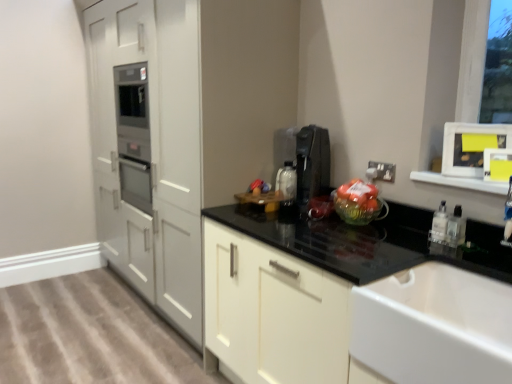
What do you see at coordinates (356, 199) in the screenshot? The width and height of the screenshot is (512, 384). I see `translucent plastic bag of oranges at center-right` at bounding box center [356, 199].

This screenshot has height=384, width=512. Describe the element at coordinates (439, 224) in the screenshot. I see `clear plastic bottle at right, which is the 2th bottle from right to left` at that location.

How much space does clear plastic bottle at right, the first bottle when ordered from left to right, occupy horizontally?

clear plastic bottle at right, the first bottle when ordered from left to right, is 2.99 inches in width.

What do you see at coordinates (384, 171) in the screenshot?
I see `white plastic electric outlet at upper right` at bounding box center [384, 171].

In order to click on translucent plastic bag of oranges at center-right in this screenshot , I will do `click(356, 199)`.

From a real-world perspective, who is located higher, clear plastic bottle at right, which is the 2th bottle from right to left, or translucent plastic bag of oranges at center-right?

translucent plastic bag of oranges at center-right is physically above.

Can you confirm if clear plastic bottle at right, the first bottle when ordered from left to right, is thinner than translucent plastic bag of oranges at center-right?

Yes, clear plastic bottle at right, the first bottle when ordered from left to right, is thinner than translucent plastic bag of oranges at center-right.

Is clear plastic bottle at right, the first bottle when ordered from left to right, not near translucent plastic bag of oranges at center-right?

Actually, clear plastic bottle at right, the first bottle when ordered from left to right, and translucent plastic bag of oranges at center-right are a little close together.

Does clear plastic bottle at right, the first bottle when ordered from left to right, appear on the left side of translucent plastic bag of oranges at center-right?

No.

Where is `glass bowl below the white plastic electric outlet at upper right (from the image's perspective)`? This screenshot has width=512, height=384. glass bowl below the white plastic electric outlet at upper right (from the image's perspective) is located at coordinates (359, 211).

From a real-world perspective, relative to white plastic electric outlet at upper right, is translucent glass bowl at center vertically above or below?

From a real-world perspective, translucent glass bowl at center is physically below white plastic electric outlet at upper right.

Who is more distant, translucent glass bowl at center or white plastic electric outlet at upper right?

white plastic electric outlet at upper right is further from the camera.

Image resolution: width=512 pixels, height=384 pixels. What are the coordinates of `appliance above the translucent glass bowl at center (from the image's perspective)` in the screenshot? It's located at (312, 163).

Is black plastic coffee machine at upper right situated inside translucent glass bowl at center or outside?

black plastic coffee machine at upper right is outside translucent glass bowl at center.

From a real-world perspective, is black plastic coffee machine at upper right physically above translucent glass bowl at center?

Correct, in the physical world, black plastic coffee machine at upper right is higher than translucent glass bowl at center.

How many degrees apart are the facing directions of black plastic coffee machine at upper right and translucent glass bowl at center?

There is a 1.95-degree angle between the facing directions of black plastic coffee machine at upper right and translucent glass bowl at center.

Is white glossy sink at lower right not near black plastic coffee machine at upper right?

No, there isn't a large distance between white glossy sink at lower right and black plastic coffee machine at upper right.

Does white glossy sink at lower right have a lesser height compared to black plastic coffee machine at upper right?

Yes, white glossy sink at lower right is shorter than black plastic coffee machine at upper right.

From the image's perspective, does white glossy sink at lower right appear lower than black plastic coffee machine at upper right?

Yes.

Could you tell me if white glossy sink at lower right is turned towards black plastic coffee machine at upper right?

No, white glossy sink at lower right is not aimed at black plastic coffee machine at upper right.

Is white plastic electric outlet at upper right completely or partially outside of clear plastic bottle at lower right, which is the second bottle from left to right?

white plastic electric outlet at upper right is positioned outside clear plastic bottle at lower right, which is the second bottle from left to right.

Does white plastic electric outlet at upper right have a larger size compared to clear plastic bottle at lower right, which is the second bottle from left to right?

No.

Find the location of a particular element. The width and height of the screenshot is (512, 384). electric outlet behind the clear plastic bottle at lower right, which is the second bottle from left to right is located at coordinates (384, 171).

From a real-world perspective, which is physically below, white plastic electric outlet at upper right or clear plastic bottle at lower right, the first bottle viewed from the right?

From a 3D spatial view, clear plastic bottle at lower right, the first bottle viewed from the right, is below.

Is translucent plastic bag of oranges at center-right outside of black plastic coffee machine at upper right?

translucent plastic bag of oranges at center-right is positioned outside black plastic coffee machine at upper right.

From a real-world perspective, who is located higher, translucent plastic bag of oranges at center-right or black plastic coffee machine at upper right?

From a 3D spatial view, black plastic coffee machine at upper right is above.

Is point (346, 202) closer to camera compared to point (305, 159)?

Yes, point (346, 202) is closer to viewer.

What's the angular difference between translucent plastic bag of oranges at center-right and black plastic coffee machine at upper right's facing directions?

1.95 degrees separate the facing orientations of translucent plastic bag of oranges at center-right and black plastic coffee machine at upper right.

Is clear plastic bottle at lower right, the first bottle viewed from the right, wider or thinner than black glossy countertop at center?

In the image, clear plastic bottle at lower right, the first bottle viewed from the right, appears to be more narrow than black glossy countertop at center.

In the image, is clear plastic bottle at lower right, the first bottle viewed from the right, positioned in front of or behind black glossy countertop at center?

clear plastic bottle at lower right, the first bottle viewed from the right, is positioned farther from the viewer than black glossy countertop at center.

Is clear plastic bottle at lower right, which is the second bottle from left to right, to the right of black glossy countertop at center from the viewer's perspective?

Correct, you'll find clear plastic bottle at lower right, which is the second bottle from left to right, to the right of black glossy countertop at center.

Find the location of a particular element. Image resolution: width=512 pixels, height=384 pixels. food behind the clear plastic bottle at right, the first bottle when ordered from left to right is located at coordinates (356, 199).

Find the location of `glass bowl on the left of the white plastic electric outlet at upper right`. glass bowl on the left of the white plastic electric outlet at upper right is located at coordinates (359, 211).

Estimate the real-world distances between objects in this image. Which object is further from translucent plastic bag of oranges at center-right, black glossy countertop at center or translucent glass bowl at center?

black glossy countertop at center is positioned further to the anchor translucent plastic bag of oranges at center-right.

Considering their positions, is white glossy sink at lower right positioned closer to black plastic coffee machine at upper right than white plastic electric outlet at upper right?

white plastic electric outlet at upper right is closer to black plastic coffee machine at upper right.

Looking at the image, which one is located closer to translucent glass bowl at center, clear plastic bottle at right, the first bottle when ordered from left to right, or black plastic coffee machine at upper right?

Among the two, black plastic coffee machine at upper right is located nearer to translucent glass bowl at center.

Considering their positions, is translucent plastic bag of oranges at center-right positioned closer to clear plastic bottle at right, which is the 2th bottle from right to left, than white plastic electric outlet at upper right?

Based on the image, white plastic electric outlet at upper right appears to be nearer to clear plastic bottle at right, which is the 2th bottle from right to left.

Based on their spatial positions, is clear plastic bottle at lower right, the first bottle viewed from the right, or translucent plastic bag of oranges at center-right further from white plastic electric outlet at upper right?

clear plastic bottle at lower right, the first bottle viewed from the right, is further to white plastic electric outlet at upper right.

Consider the image. Estimate the real-world distances between objects in this image. Which object is closer to black glossy countertop at center, translucent plastic bag of oranges at center-right or white glossy sink at lower right?

white glossy sink at lower right lies closer to black glossy countertop at center than the other object.

Based on their spatial positions, is black plastic coffee machine at upper right or translucent plastic bag of oranges at center-right closer to white plastic electric outlet at upper right?

translucent plastic bag of oranges at center-right is closer to white plastic electric outlet at upper right.

Looking at the image, which one is located further to black glossy countertop at center, clear plastic bottle at right, which is the 2th bottle from right to left, or translucent plastic bag of oranges at center-right?

Based on the image, clear plastic bottle at right, which is the 2th bottle from right to left, appears to be further to black glossy countertop at center.

This screenshot has height=384, width=512. Identify the location of food positioned between black glossy countertop at center and white plastic electric outlet at upper right from near to far. (356, 199).

Image resolution: width=512 pixels, height=384 pixels. Identify the location of bottle between translucent plastic bag of oranges at center-right and clear plastic bottle at lower right, which is the second bottle from left to right, in the horizontal direction. (439, 224).

Where is `glass bowl positioned between black glossy countertop at center and black plastic coffee machine at upper right from near to far`? glass bowl positioned between black glossy countertop at center and black plastic coffee machine at upper right from near to far is located at coordinates (359, 211).

Identify the location of food between black plastic coffee machine at upper right and clear plastic bottle at lower right, which is the second bottle from left to right. (356, 199).